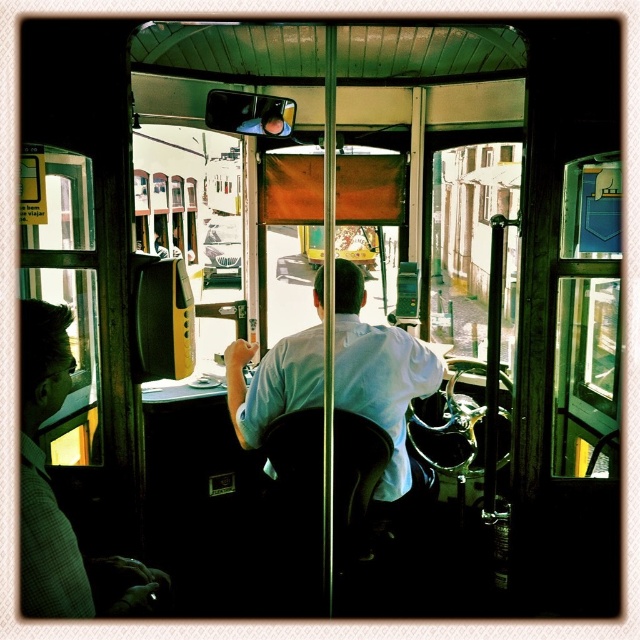
You are a passenger sitting in the front of the tram. You notice two points marked on the window. The first point is at coordinates point (241, 371) and the second is at point (106, 577). Which point is closer to you?

Point (241, 371) is further to the camera than point (106, 577), so the point closer to you is point (106, 577).

You are a passenger in the tram and want to know if the white shirt at center is bigger than the matte black coach at left. Based on the scene, can you confirm?

The white shirt at center has a larger size compared to matte black coach at left, so yes, the white shirt at center is bigger than the matte black coach at left.